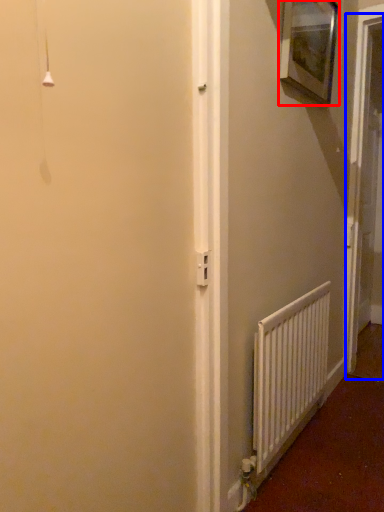
Question: Which point is further to the camera, picture frame (highlighted by a red box) or screen door (highlighted by a blue box)?

Choices:
 (A) picture frame
 (B) screen door

Answer: (B)